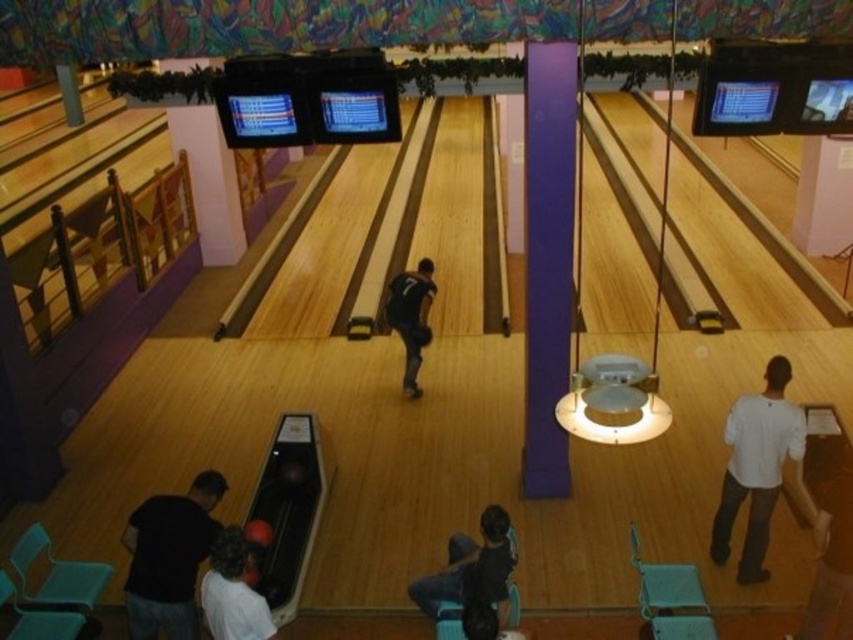
You are standing at the origin point of the coordinate system in the bowling alley. The coordinate system has its origin at the bottom left corner of the image, with the x and y axes increasing to the right and up respectively. You need to locate the black cotton shirt at lower left. What are its coordinates?

The coordinates of the black cotton shirt at lower left are at point (169, 557).

You are a photographer standing at the back of the bowling alley and want to take a photo that includes both the black cotton shirt at lower left and the white matte shirt at right. Based on their positions, which shirt should you adjust your camera angle to focus on first to ensure both are in frame?

The black cotton shirt at lower left is to the left of the white matte shirt at right, so you should focus on the black cotton shirt at lower left first to ensure both are captured in the frame.

You are a photographer standing at the back of the bowling alley and want to take a photo of both the black cotton shirt at lower left and the white matte shirt at right. Which shirt should you adjust your camera angle to focus on first if you want to capture both in the same frame?

The black cotton shirt at lower left is below the white matte shirt at right, so you should adjust your camera angle to focus on the black cotton shirt at lower left first to ensure both shirts are in the frame.